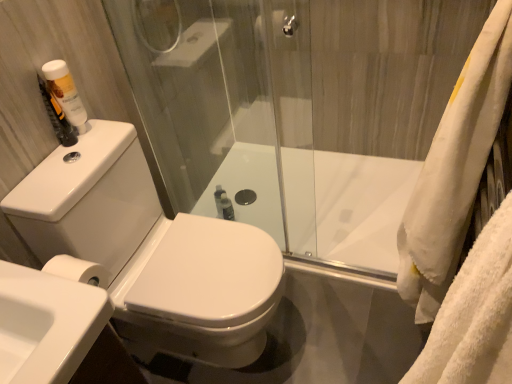
The width and height of the screenshot is (512, 384). Find the location of `free space above white glossy sink at lower left (from a real-world perspective)`. free space above white glossy sink at lower left (from a real-world perspective) is located at coordinates (38, 296).